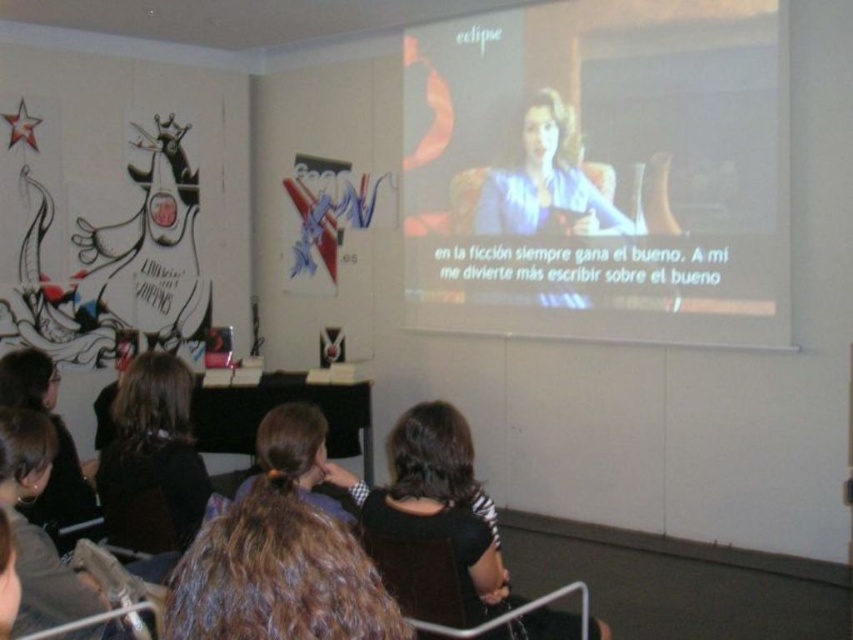
Question: Which of these objects is positioned farthest from the brown hair at center?

Choices:
 (A) white matte projection screen at upper center
 (B) black and white striped shirt at center
 (C) dark brown hair at lower left

Answer: (A)

Question: Does black and white striped shirt at center appear on the right side of dark brown hair at lower left?

Choices:
 (A) yes
 (B) no

Answer: (A)

Question: Is brown hair at center positioned at the back of dark brown hair at lower left?

Choices:
 (A) no
 (B) yes

Answer: (A)

Question: Can you confirm if brown hair at center is positioned to the left of black and white striped shirt at center?

Choices:
 (A) no
 (B) yes

Answer: (B)

Question: Which of the following is the closest to the observer?

Choices:
 (A) (198, 499)
 (B) (219, 570)
 (C) (450, 454)

Answer: (B)

Question: Which of the following is the farthest from the observer?

Choices:
 (A) white matte projection screen at upper center
 (B) black and white striped shirt at center

Answer: (A)